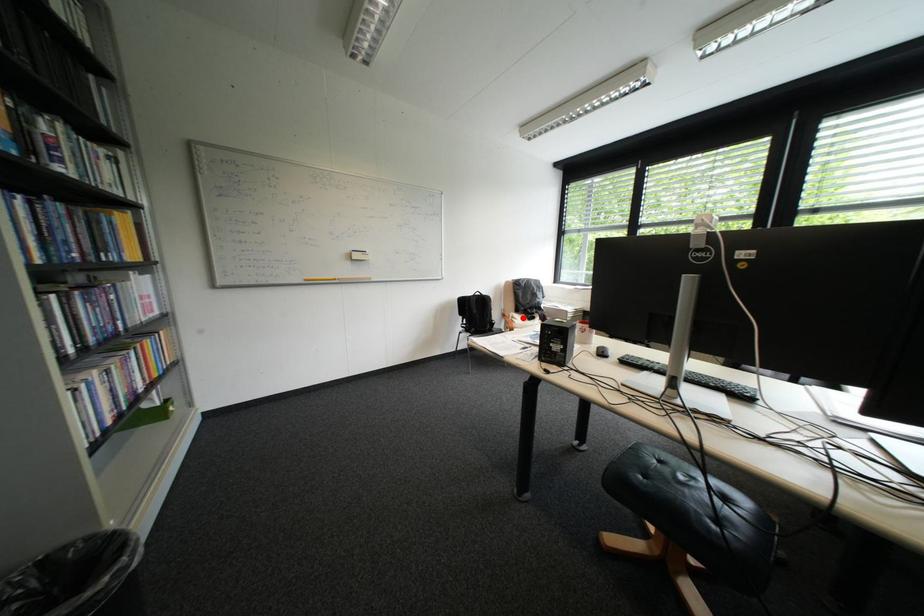
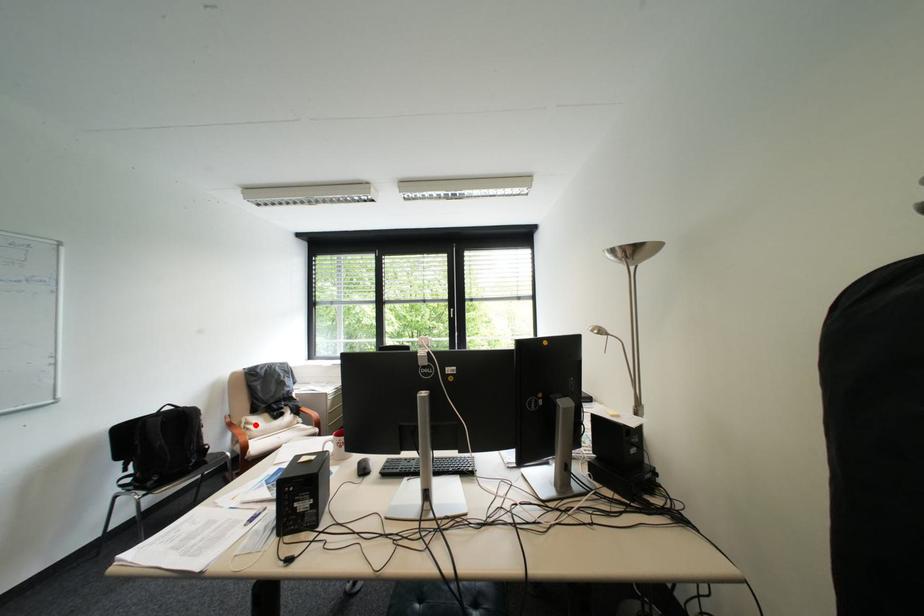
I am providing you with two images of the same scene from different viewpoints. A red point is marked on the first image and another point is marked on the second image. Is the marked point in image1 the same physical position as the marked point in image2?

Yes